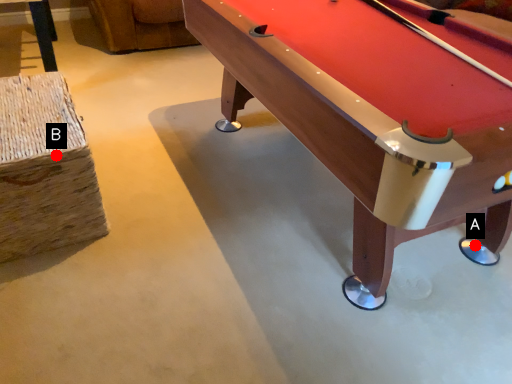
Question: Two points are circled on the image, labeled by A and B beside each circle. Which point is closer to the camera?

Choices:
 (A) A is closer
 (B) B is closer

Answer: (B)